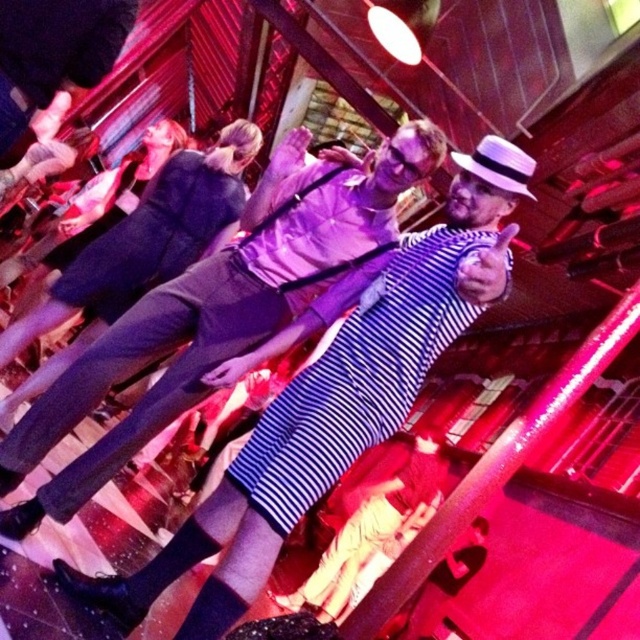
Who is positioned more to the left, striped fabric shirt at center or matte black dress at center?

matte black dress at center

Does striped fabric shirt at center have a greater width compared to matte black dress at center?

Yes, striped fabric shirt at center is wider than matte black dress at center.

Which is in front, point (202, 532) or point (193, 198)?

Point (202, 532) is in front.

The image size is (640, 640). I want to click on striped fabric shirt at center, so click(x=337, y=401).

Describe the element at coordinates (140, 252) in the screenshot. I see `matte black dress at center` at that location.

Between matte black dress at center and striped fabric dress at center, which one has less height?

striped fabric dress at center is shorter.

Who is more forward, (90, 292) or (376, 488)?

Positioned in front is point (90, 292).

The width and height of the screenshot is (640, 640). What are the coordinates of `matte black dress at center` in the screenshot? It's located at (140, 252).

Does striped fabric shirt at center have a lesser height compared to striped fabric dress at center?

Incorrect, striped fabric shirt at center's height does not fall short of striped fabric dress at center's.

Is striped fabric shirt at center further to the viewer compared to striped fabric dress at center?

No, striped fabric shirt at center is in front of striped fabric dress at center.

Between point (241, 451) and point (388, 488), which one is positioned in front?

Positioned in front is point (241, 451).

Locate an element on the screen. This screenshot has width=640, height=640. striped fabric shirt at center is located at coordinates (337, 401).